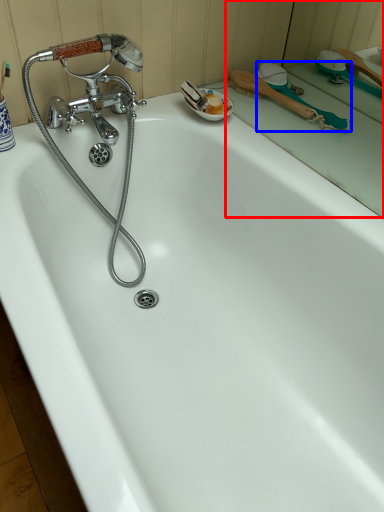
Question: Which of the following is the closest to the observer, mirror (highlighted by a red box) or shower (highlighted by a blue box)?

Choices:
 (A) mirror
 (B) shower

Answer: (A)